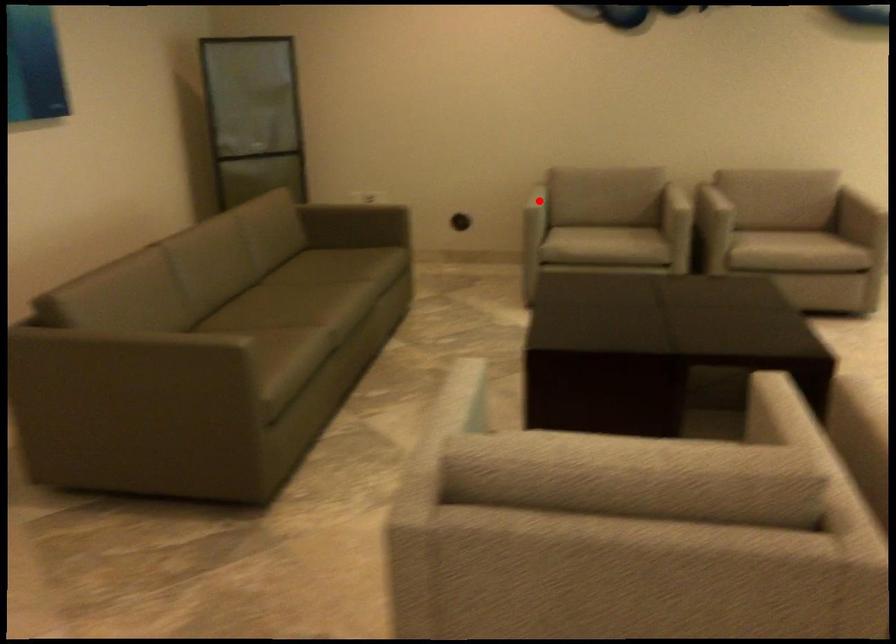
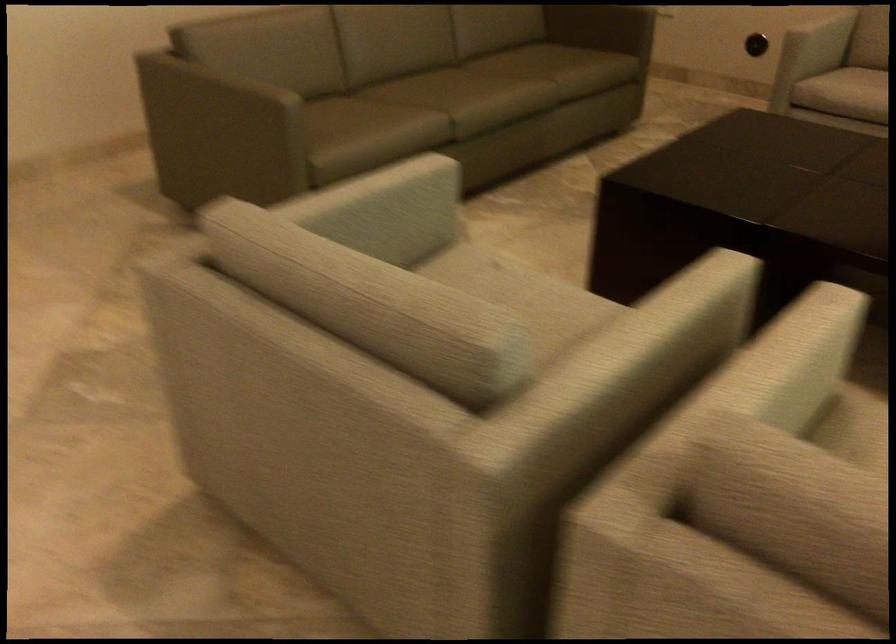
The point at the highlighted location is marked in the first image. Where is the corresponding point in the second image?

(821, 35)